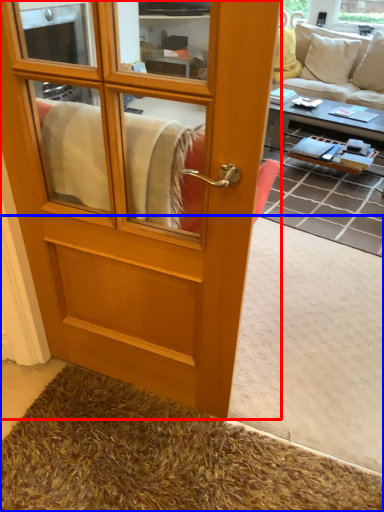
Question: Which point is closer to the camera, screen door (highlighted by a red box) or carpets (highlighted by a blue box)?

Choices:
 (A) screen door
 (B) carpets

Answer: (A)